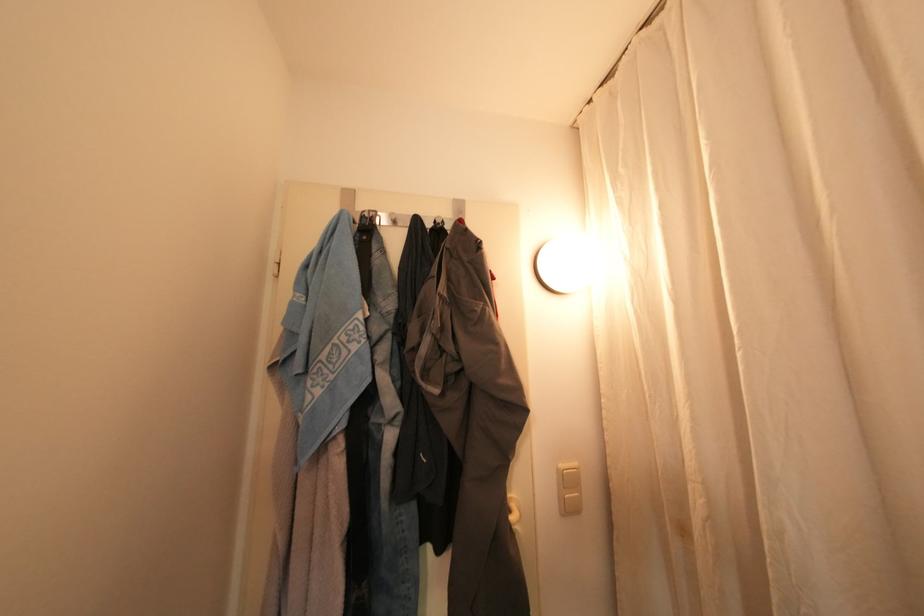
What do you see at coordinates (514, 509) in the screenshot? I see `a white door handle` at bounding box center [514, 509].